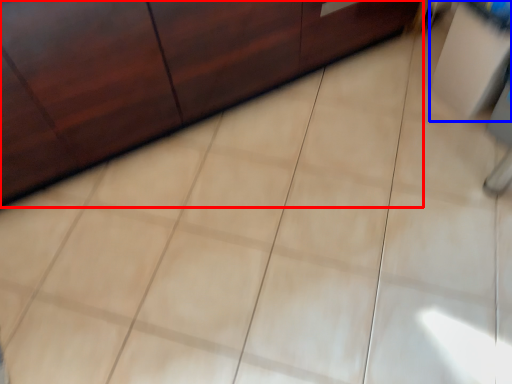
Question: Which object is closer to the camera taking this photo, furniture (highlighted by a red box) or vanity (highlighted by a blue box)?

Choices:
 (A) furniture
 (B) vanity

Answer: (A)